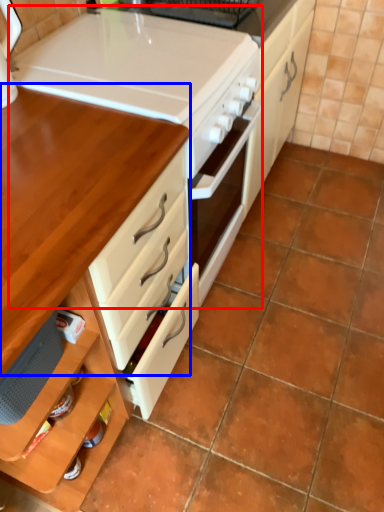
Question: Which object appears closest to the camera in this image, appliance (highlighted by a red box) or table (highlighted by a blue box)?

Choices:
 (A) appliance
 (B) table

Answer: (B)